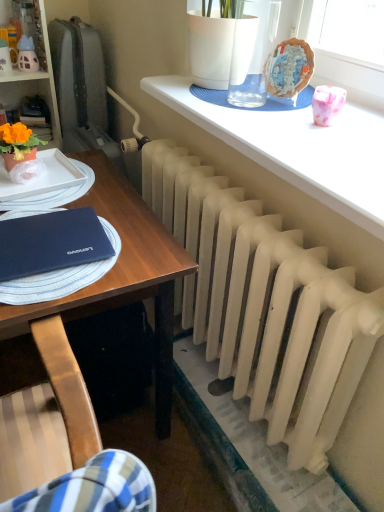
This screenshot has width=384, height=512. In order to click on vacant space situated above white matte desk at center (from a real-world perspective) in this screenshot , I will do `click(49, 210)`.